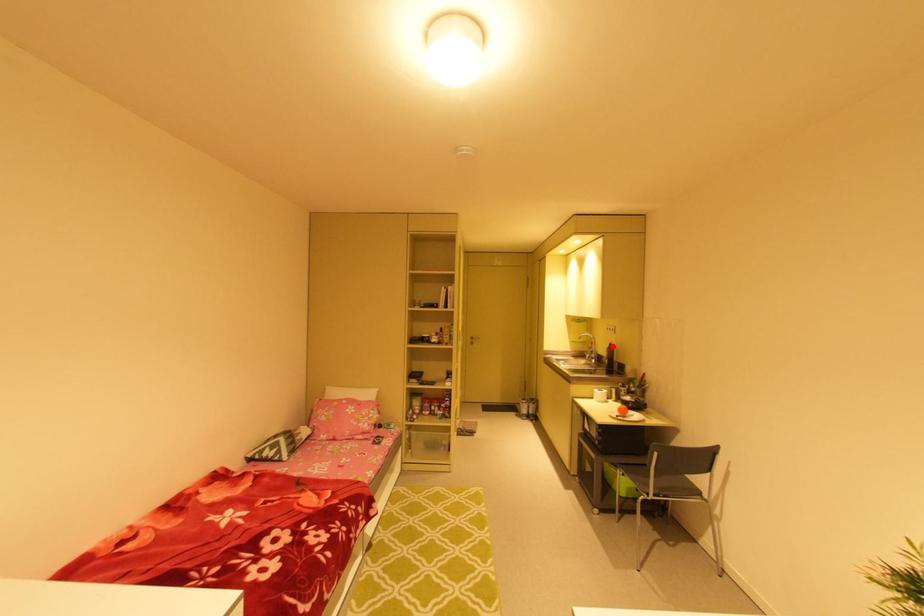
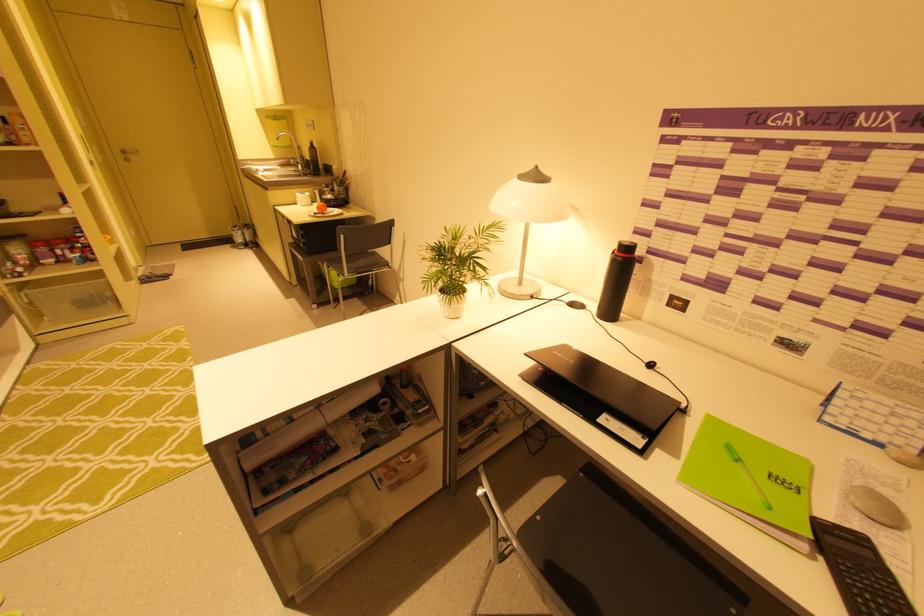
Question: I am providing you with two images of the same scene from different viewpoints. A red point is shown in image1. For the corresponding object point in image2, is it positioned nearer or farther from the camera?

Choices:
 (A) Nearer
 (B) Farther

Answer: (A)